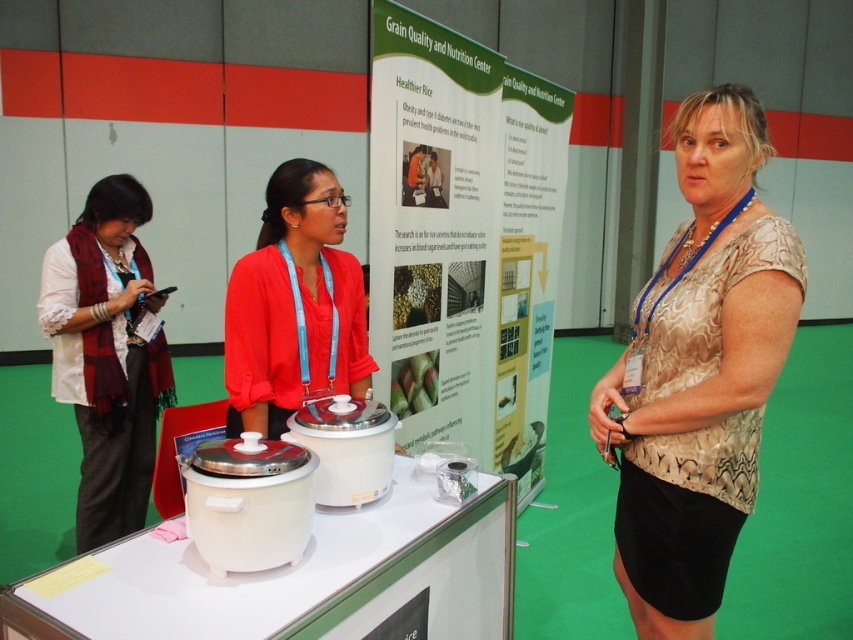
You are a photographer at the event and need to position a light source to highlight the gold textured blouse at center. Given that the light source can only be placed along the horizontal axis, which direction should you place it to ensure the blouse is well lit?

The gold textured blouse at center is positioned at point 0.583 on the horizontal axis. To ensure proper lighting, the light source should be placed to the left of the blouse since the coordinate system typically places 0 at the left edge. This would direct light towards the blouse from the left side.

You are at the Grain Quality and Nutrition Center booth and see the green paperboard poster at center and the matte white scarf at left. Which object is wider?

The green paperboard poster at center might be wider than matte white scarf at left.

What is the purpose of the point marked at coordinates (x=463, y=240) in the image?

The point marked at coordinates (x=463, y=240) indicates the location of the green paperboard poster at center in the image.